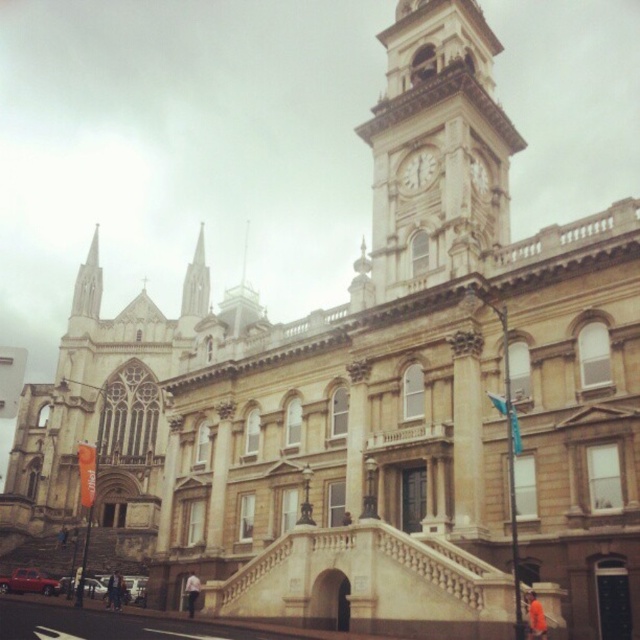
Does light brown stone clock tower at upper right have a greater width compared to matte gold clock at upper center?

Correct, the width of light brown stone clock tower at upper right exceeds that of matte gold clock at upper center.

Which is behind, point (465, 221) or point (416, 193)?

The point (416, 193) is behind.

At what (x,y) coordinates should I click in order to perform the action: click on light brown stone clock tower at upper right. Please return your answer as a coordinate pair (x, y). The image size is (640, 640). Looking at the image, I should click on (436, 148).

Which is more to the left, matte gold clock at upper center or matte stone clock at upper center?

From the viewer's perspective, matte gold clock at upper center appears more on the left side.

The image size is (640, 640). Describe the element at coordinates (417, 170) in the screenshot. I see `matte gold clock at upper center` at that location.

This screenshot has height=640, width=640. In order to click on matte gold clock at upper center in this screenshot , I will do `click(417, 170)`.

Between light brown stone clock tower at upper right and matte stone clock at upper center, which one has less height?

Standing shorter between the two is matte stone clock at upper center.

Between light brown stone clock tower at upper right and matte stone clock at upper center, which one has more height?

With more height is light brown stone clock tower at upper right.

The width and height of the screenshot is (640, 640). I want to click on light brown stone clock tower at upper right, so click(436, 148).